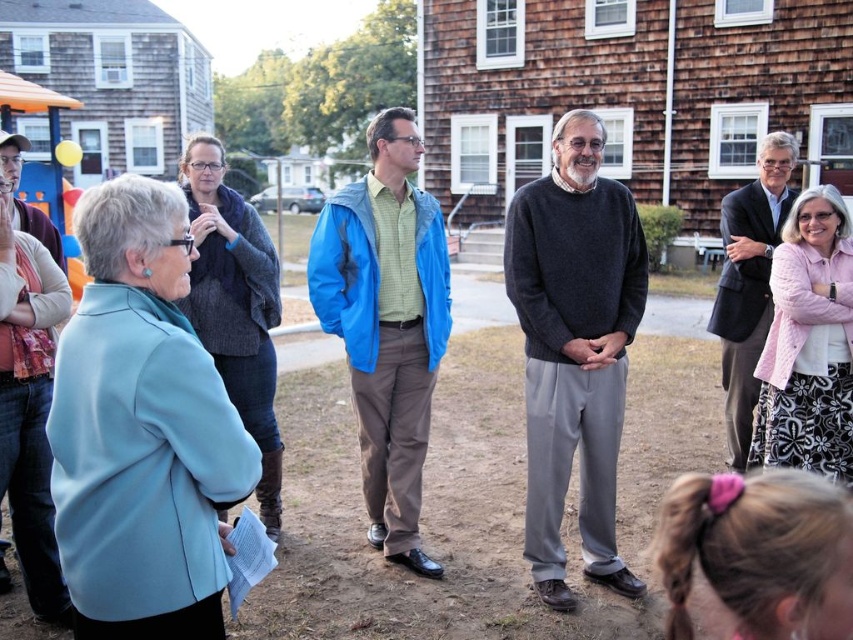
Is blue fabric jacket at center to the right of dark gray suit at right from the viewer's perspective?

No, blue fabric jacket at center is not to the right of dark gray suit at right.

The width and height of the screenshot is (853, 640). Find the location of `blue fabric jacket at center`. blue fabric jacket at center is located at coordinates (386, 323).

Locate an element on the screen. Image resolution: width=853 pixels, height=640 pixels. blue fabric jacket at center is located at coordinates (386, 323).

From the picture: Can you confirm if dark gray sweater at center is positioned to the left of dark gray suit at right?

Yes, dark gray sweater at center is to the left of dark gray suit at right.

Is dark gray sweater at center positioned at the back of dark gray suit at right?

No, it is in front of dark gray suit at right.

Does point (554, 278) lie in front of point (782, 147)?

That is True.

Image resolution: width=853 pixels, height=640 pixels. Find the location of `dark gray sweater at center`. dark gray sweater at center is located at coordinates (573, 348).

Who is shorter, dark gray sweater at center or blue fabric jacket at center?

dark gray sweater at center

Can you confirm if dark gray sweater at center is positioned below blue fabric jacket at center?

Yes.

I want to click on dark gray sweater at center, so click(x=573, y=348).